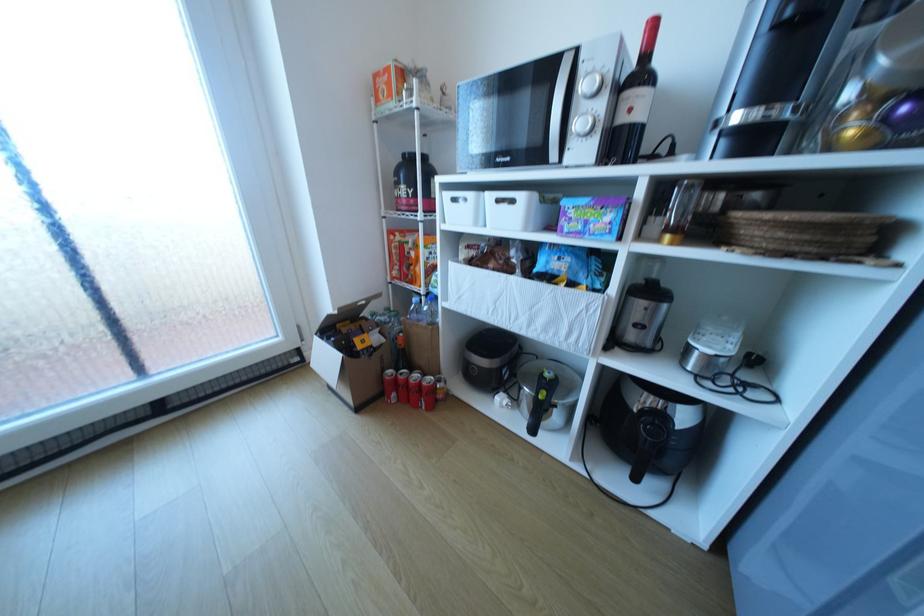
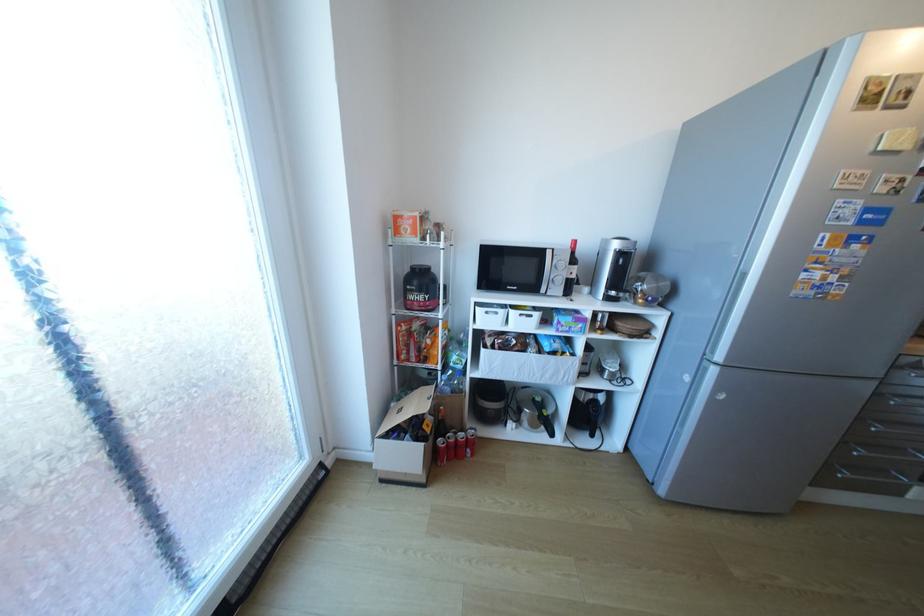
Where in the second image is the point corresponding to point 406,377 from the first image?

(456, 442)